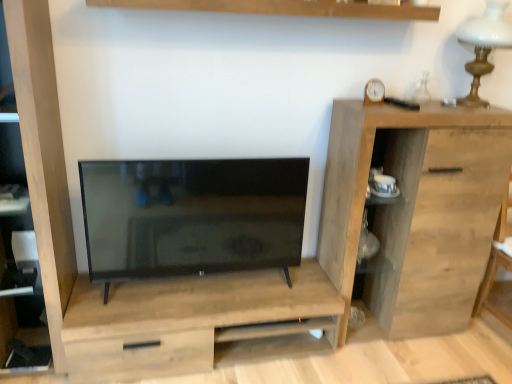
What is the approximate height of natural wood cabinet at right?

1.17 meters.

This screenshot has height=384, width=512. Describe the element at coordinates (415, 210) in the screenshot. I see `natural wood cabinet at right` at that location.

The image size is (512, 384). Describe the element at coordinates (192, 216) in the screenshot. I see `matte black tv at center` at that location.

Identify the location of light wood dresser at center. The image size is (512, 384). (189, 320).

Consider the image. Measure the distance between wooden clock at upper right and camera.

The depth of wooden clock at upper right is 1.78 meters.

What do you see at coordinates (374, 92) in the screenshot? I see `wooden clock at upper right` at bounding box center [374, 92].

Identify the location of white glass table lamp at upper right. The width and height of the screenshot is (512, 384). (483, 45).

Which point is more forward, (369, 11) or (243, 303)?

The point (369, 11) is more forward.

Is wooden shelf at upper center wider than light wood dresser at center?

No.

Based on the photo, from the image's perspective, is wooden shelf at upper center over light wood dresser at center?

Yes, from the image's perspective, wooden shelf at upper center is over light wood dresser at center.

From a real-world perspective, is wooden shelf at upper center positioned above or below wooden clock at upper right?

From a real-world perspective, wooden shelf at upper center is physically above wooden clock at upper right.

Is wooden shelf at upper center closer to camera compared to wooden clock at upper right?

Yes, wooden shelf at upper center is in front of wooden clock at upper right.

What's the angular difference between wooden shelf at upper center and wooden clock at upper right's facing directions?

8.17 degrees.

From the image's perspective, relative to wooden clock at upper right, is wooden shelf at upper center above or below?

Clearly, from the image's perspective, wooden shelf at upper center is above wooden clock at upper right.

Can you confirm if white glass table lamp at upper right is bigger than natural wood cabinet at right?

Actually, white glass table lamp at upper right might be smaller than natural wood cabinet at right.

Does point (469, 26) appear closer or farther from the camera than point (439, 268)?

Point (469, 26) is closer to the camera than point (439, 268).

Based on the photo, is white glass table lamp at upper right not close to natural wood cabinet at right?

No, white glass table lamp at upper right is not far from natural wood cabinet at right.

Identify the location of table lamp positioned vertically above the natural wood cabinet at right (from a real-world perspective). Image resolution: width=512 pixels, height=384 pixels. (483, 45).

Is wooden clock at upper right oriented towards matte black tv at center?

No, wooden clock at upper right is not turned towards matte black tv at center.

Is wooden clock at upper right touching matte black tv at center?

No.

From a real-world perspective, which object rests below the other?

From a 3D spatial view, matte black tv at center is below.

Considering the sizes of light brown wood cabinet at left and white glass table lamp at upper right in the image, is light brown wood cabinet at left taller or shorter than white glass table lamp at upper right?

Considering their sizes, light brown wood cabinet at left has more height than white glass table lamp at upper right.

Is white glass table lamp at upper right surrounded by light brown wood cabinet at left?

No, white glass table lamp at upper right is not a part of light brown wood cabinet at left.

From a real-world perspective, relative to white glass table lamp at upper right, is light brown wood cabinet at left vertically above or below?

light brown wood cabinet at left is situated lower than white glass table lamp at upper right in the real world.

Would you say natural wood cabinet at right is inside or outside wooden clock at upper right?

natural wood cabinet at right is located beyond the bounds of wooden clock at upper right.

Considering the relative positions of natural wood cabinet at right and wooden clock at upper right in the image provided, is natural wood cabinet at right to the right of wooden clock at upper right from the viewer's perspective?

Yes, natural wood cabinet at right is to the right of wooden clock at upper right.

Are natural wood cabinet at right and wooden clock at upper right located far from each other?

Actually, natural wood cabinet at right and wooden clock at upper right are a little close together.

Does white glass table lamp at upper right have a smaller size compared to light wood dresser at center?

Indeed, white glass table lamp at upper right has a smaller size compared to light wood dresser at center.

The width and height of the screenshot is (512, 384). Identify the location of dresser on the left of white glass table lamp at upper right. (189, 320).

Measure the distance from white glass table lamp at upper right to light wood dresser at center.

They are 5.14 feet apart.

Can you confirm if white glass table lamp at upper right is shorter than light wood dresser at center?

Incorrect, the height of white glass table lamp at upper right does not fall short of that of light wood dresser at center.

Locate an element on the screen. This screenshot has height=384, width=512. dresser below the wooden shelf at upper center (from a real-world perspective) is located at coordinates (189, 320).

You are a GUI agent. You are given a task and a screenshot of the screen. Output one action in this format:
    pyautogui.click(x=<x>, y=<y>)
    Task: Click on the shelf that is above the wooden clock at upper right (from a real-world perspective)
    Image resolution: width=512 pixels, height=384 pixels.
    Given the screenshot: What is the action you would take?
    pyautogui.click(x=285, y=8)

Based on their spatial positions, is light wood dresser at center or light brown wood cabinet at left closer to wooden clock at upper right?

The object closer to wooden clock at upper right is light wood dresser at center.

Based on their spatial positions, is wooden shelf at upper center or light wood dresser at center closer to white glass table lamp at upper right?

wooden shelf at upper center is closer to white glass table lamp at upper right.

Consider the image. From the image, which object appears to be nearer to light brown wood cabinet at left, natural wood cabinet at right or light wood dresser at center?

light wood dresser at center lies closer to light brown wood cabinet at left than the other object.

Estimate the real-world distances between objects in this image. Which object is further from wooden clock at upper right, light brown wood cabinet at left or matte black tv at center?

light brown wood cabinet at left is further to wooden clock at upper right.

Based on their spatial positions, is light wood dresser at center or wooden clock at upper right further from white glass table lamp at upper right?

light wood dresser at center is positioned further to the anchor white glass table lamp at upper right.

Estimate the real-world distances between objects in this image. Which object is closer to light brown wood cabinet at left, wooden shelf at upper center or white glass table lamp at upper right?

wooden shelf at upper center is closer to light brown wood cabinet at left.

Based on their spatial positions, is white glass table lamp at upper right or matte black tv at center closer to natural wood cabinet at right?

matte black tv at center.

Considering their positions, is matte black tv at center positioned further to natural wood cabinet at right than white glass table lamp at upper right?

The object further to natural wood cabinet at right is white glass table lamp at upper right.

Where is `clock between white glass table lamp at upper right and natural wood cabinet at right in the up-down direction`? The height and width of the screenshot is (384, 512). clock between white glass table lamp at upper right and natural wood cabinet at right in the up-down direction is located at coordinates (374, 92).

This screenshot has height=384, width=512. What are the coordinates of `chest of drawers between wooden clock at upper right and light wood dresser at center from top to bottom` in the screenshot? It's located at (415, 210).

What are the coordinates of `clock between matte black tv at center and white glass table lamp at upper right` in the screenshot? It's located at (374, 92).

Locate an element on the screen. The image size is (512, 384). shelf located between matte black tv at center and white glass table lamp at upper right in the left-right direction is located at coordinates (285, 8).